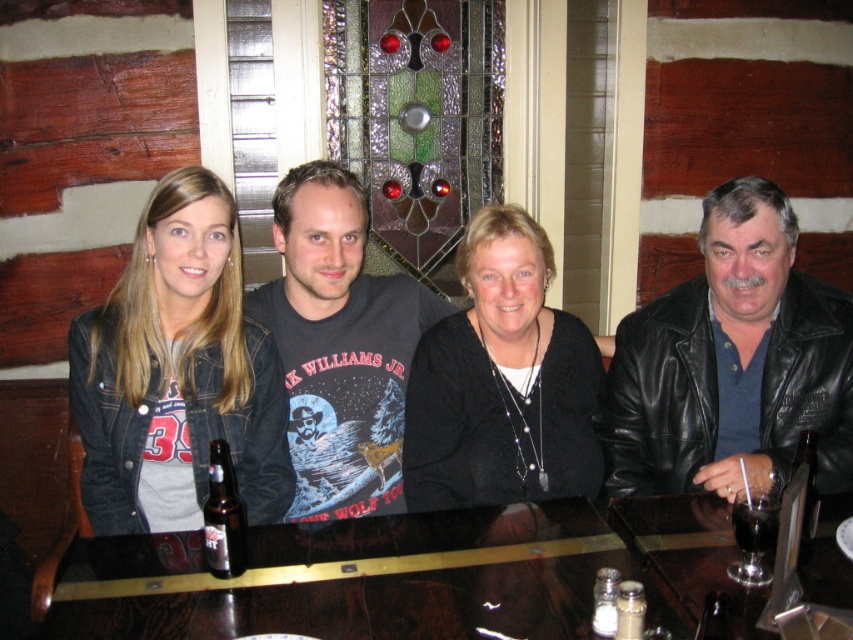
You are sitting at a table in a rustic restaurant and want to place your phone on the shiny dark wood table at center. However, there is a black leather jacket at right on the seat. Can you place your phone there without moving the jacket?

The shiny dark wood table at center is to the left of the black leather jacket at right, so the jacket is on the seat to the right of the table. Since the jacket is on the seat and not on the table, you can safely place your phone on the shiny dark wood table at center without moving the jacket.

You are a barista preparing to place a new menu board between the black leather jacket at right and the denim jacket at left. The menu board is 1.2 meters wide. Can you fit it between them without moving the jackets?

The black leather jacket at right has a larger size compared to denim jacket at left. Since the menu board is 1.2 meters wide, but the distance between the two jackets isn not specified, it is impossible to determine if it will fit without knowing the actual space between them.

Consider the image. You are a server at the bar and need to place a 12 inch long drink tray between the shiny dark wood table at center and the black leather jacket at right. Can you fit it there?

The shiny dark wood table at center is 16.69 inches from the black leather jacket at right. Since the drink tray is 12 inches long, it can fit in the space between them as the distance is sufficient.